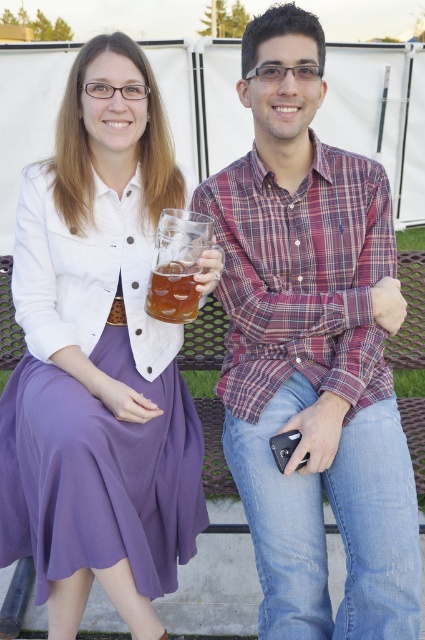
Is point (240, 173) behind point (19, 522)?

Yes, it is.

Identify the location of plaid shirt at center. Image resolution: width=425 pixels, height=640 pixels. (311, 353).

The image size is (425, 640). Describe the element at coordinates (311, 353) in the screenshot. I see `plaid shirt at center` at that location.

Can you confirm if plaid shirt at center is positioned to the right of translucent glass mug at center?

Correct, you'll find plaid shirt at center to the right of translucent glass mug at center.

Locate an element on the screen. Image resolution: width=425 pixels, height=640 pixels. plaid shirt at center is located at coordinates (311, 353).

Find the location of a particular element. Image resolution: width=425 pixels, height=640 pixels. matte glass mug at left is located at coordinates (99, 358).

In the scene shown: Between matte glass mug at left and translucent glass mug at center, which one is positioned higher?

translucent glass mug at center is above.

Does point (135, 218) lie behind point (175, 307)?

Yes.

This screenshot has height=640, width=425. I want to click on matte glass mug at left, so click(99, 358).